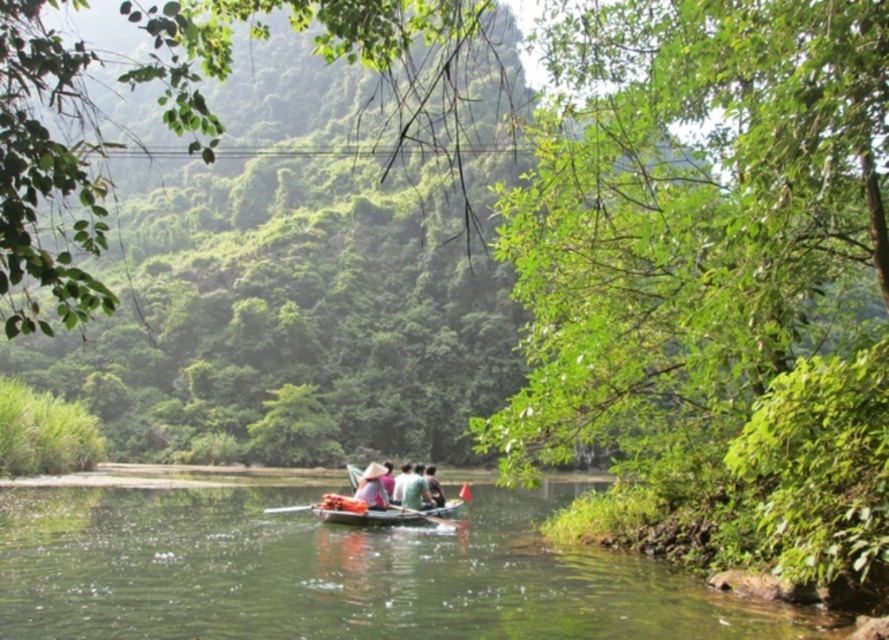
You are standing on the riverbank and want to reach the point marked as point (395, 509). The boat is currently at the dock, which is 30 meters away from you. If the boat can travel at 5 meters per minute, how many minutes will it take for the boat to reach the point from the dock?

The boat needs to travel 24.66 meters to reach point (395, 509) from the dock. At a speed of 5 meters per minute, it will take approximately 24.66 divided by 5 equals 4.93 minutes, so around 5 minutes.

Based on the coordinates provided, what object is located at point (x=387, y=515) in the scene?

The point (x=387, y=515) corresponds to the wooden canoe at center.